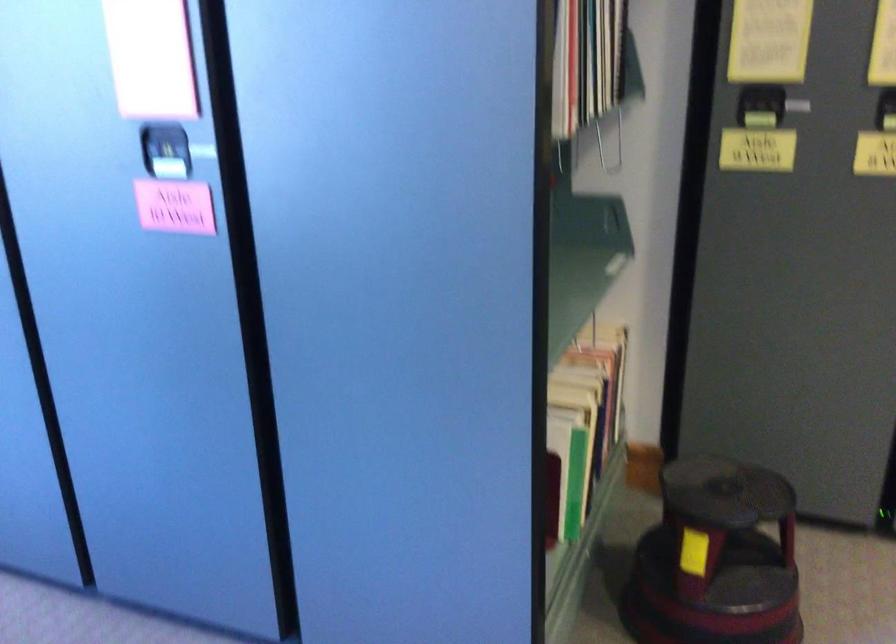
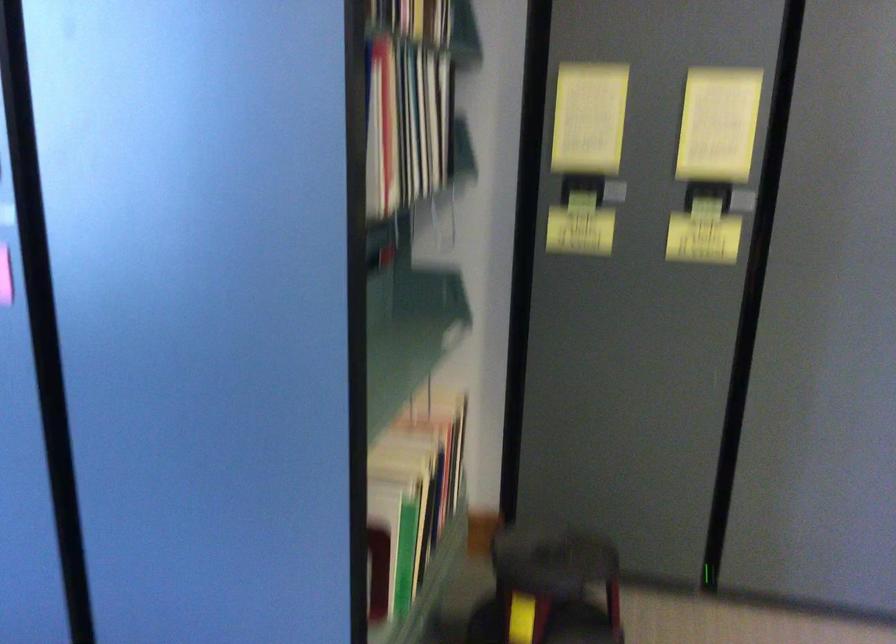
Locate, in the second image, the point that corresponds to pixel 586 415 in the first image.

(416, 489)